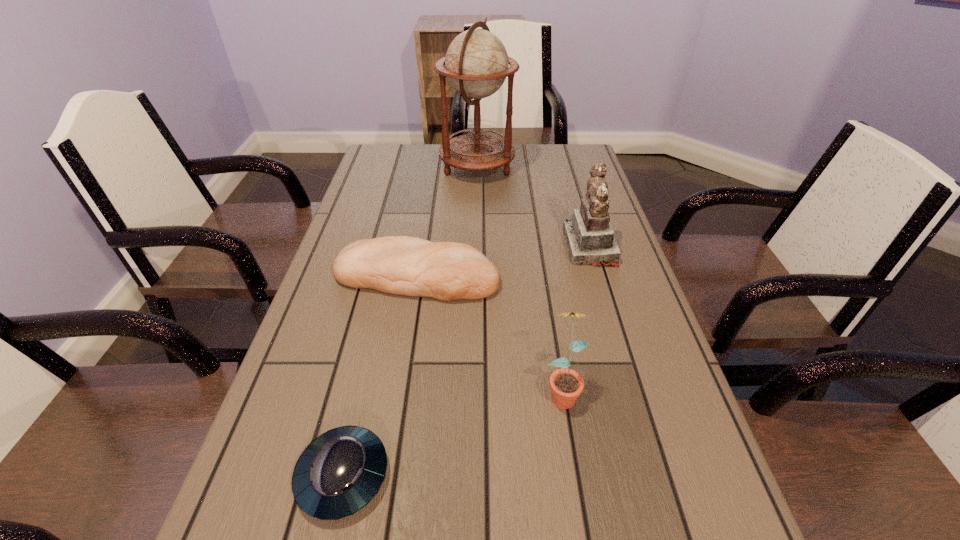
Find the location of a particular element. Image resolution: width=960 pixels, height=540 pixels. vacant space located on the front-facing side of the rightmost object is located at coordinates (460, 247).

I want to click on free space located 0.310m on the front-facing side of the rightmost object, so click(448, 247).

Image resolution: width=960 pixels, height=540 pixels. I want to click on vacant space located 0.190m on the flower of the second object from right to left, so click(584, 528).

Identify the location of vacant space situated 0.270m on the back of the bread. (430, 196).

You are a GUI agent. You are given a task and a screenshot of the screen. Output one action in this format:
    pyautogui.click(x=<x>, y=<y>)
    Task: Click on the free space located 0.060m on the back of the nearest object
    This screenshot has width=960, height=540.
    Given the screenshot: What is the action you would take?
    pyautogui.click(x=360, y=402)

Where is `object at the far edge`? The height and width of the screenshot is (540, 960). object at the far edge is located at coordinates (476, 64).

You are a GUI agent. You are given a task and a screenshot of the screen. Output one action in this format:
    pyautogui.click(x=<x>, y=<y>)
    Task: Click on the bread located in the left edge section of the desktop
    The width and height of the screenshot is (960, 540).
    Given the screenshot: What is the action you would take?
    pyautogui.click(x=401, y=265)

Identify the location of saucer located in the left edge section of the desktop. This screenshot has height=540, width=960. (339, 472).

I want to click on object at the right edge, so click(590, 240).

This screenshot has height=540, width=960. Find the location of `free region at the far edge`. free region at the far edge is located at coordinates (432, 147).